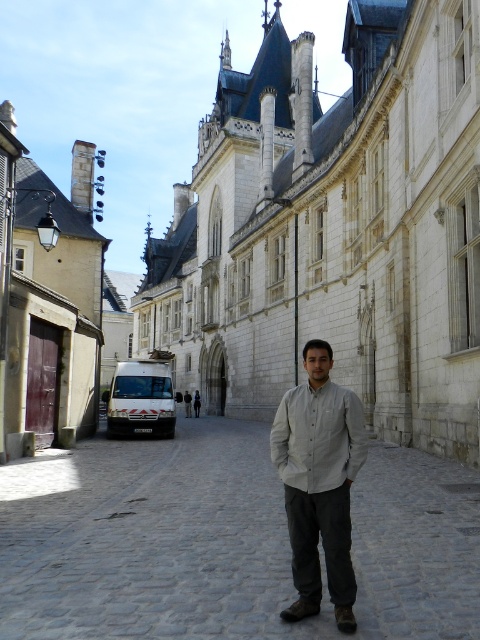
Question: Does white stone building at center lie in front of matte red door at left?

Choices:
 (A) yes
 (B) no

Answer: (A)

Question: Which of the following is the farthest from the observer?

Choices:
 (A) light gray shirt at center
 (B) matte red door at left
 (C) white stone building at center
 (D) gray cobblestone alley at center

Answer: (B)

Question: Considering the real-world distances, which object is closest to the white stone building at center?

Choices:
 (A) light gray shirt at center
 (B) matte red door at left
 (C) gray cobblestone alley at center

Answer: (B)

Question: Does matte red door at left lie behind light gray shirt at center?

Choices:
 (A) yes
 (B) no

Answer: (A)

Question: Is white stone building at center smaller than gray cobblestone alley at center?

Choices:
 (A) no
 (B) yes

Answer: (A)

Question: Which point is closer to the camera taking this photo?

Choices:
 (A) (x=4, y=540)
 (B) (x=468, y=234)
 (C) (x=98, y=289)

Answer: (A)